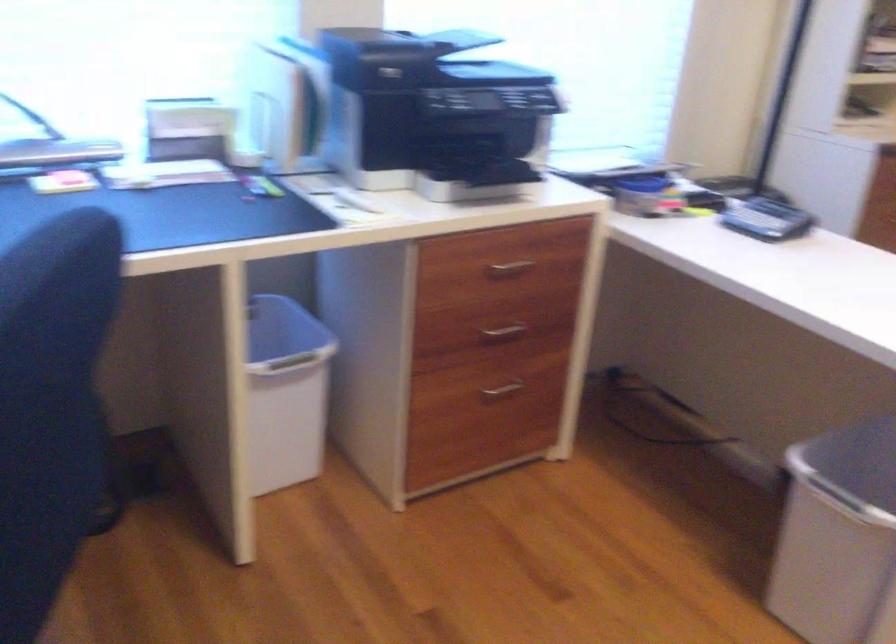
Which object does [767,220] point to?

It corresponds to the grey calculator in the image.